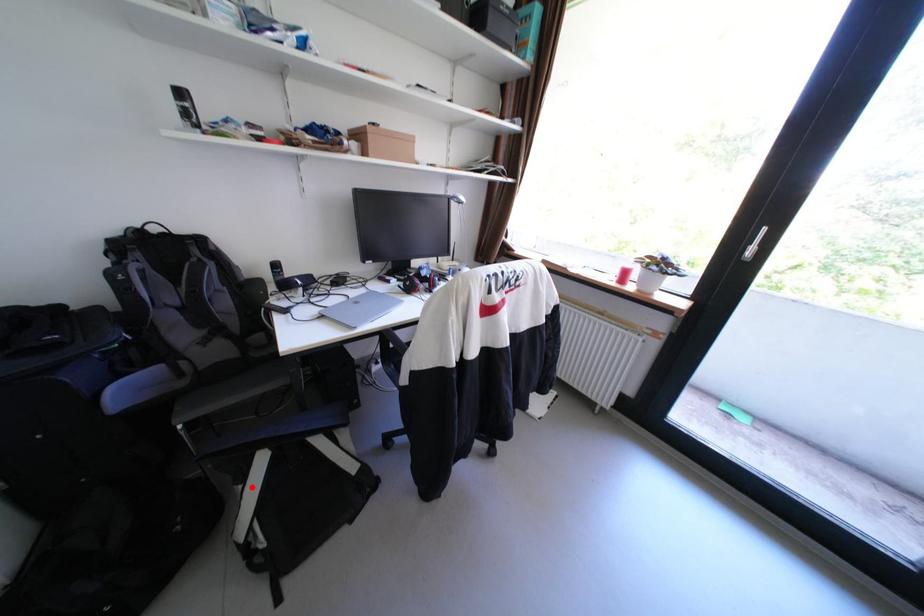
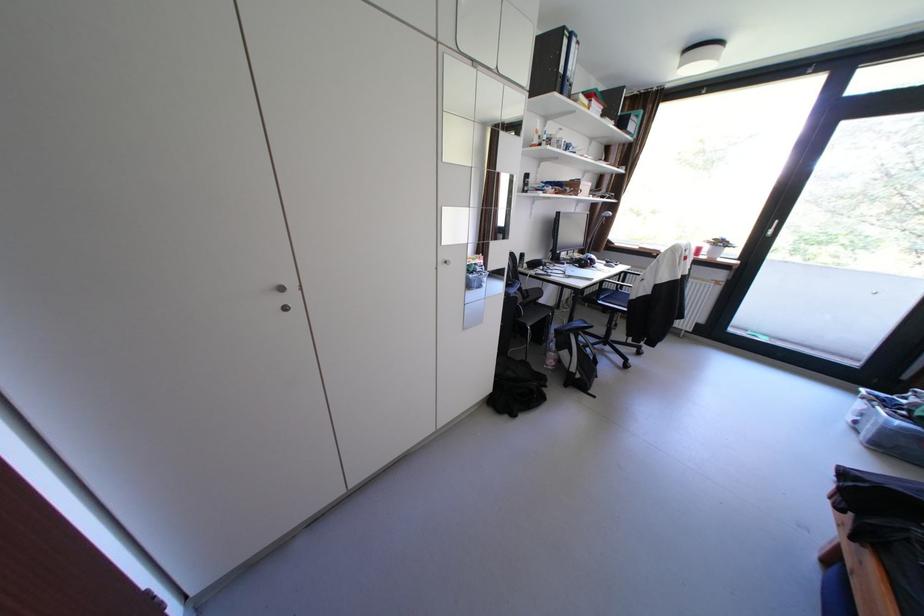
Question: I am providing you with two images of the same scene from different viewpoints. Image1 has a red point marked. In image2, the corresponding 3D location appears at what relative position? Reply with the corresponding letter.

Choices:
 (A) Closer
 (B) Farther

Answer: (A)